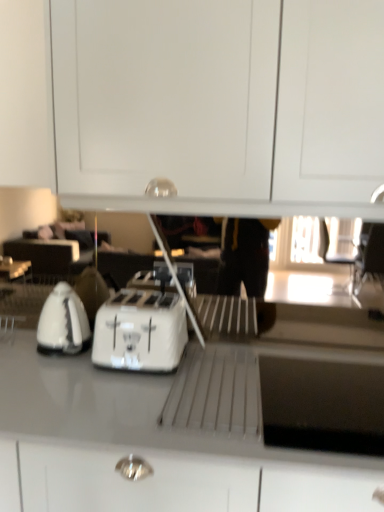
Question: From a real-world perspective, does white glossy countertop at center stand above white glossy kettle at left?

Choices:
 (A) yes
 (B) no

Answer: (B)

Question: Is white glossy countertop at center surrounding white glossy kettle at left?

Choices:
 (A) no
 (B) yes

Answer: (A)

Question: Does white glossy countertop at center come in front of white glossy kettle at left?

Choices:
 (A) no
 (B) yes

Answer: (B)

Question: Is white glossy countertop at center touching white glossy kettle at left?

Choices:
 (A) no
 (B) yes

Answer: (A)

Question: Is white glossy countertop at center smaller than white glossy kettle at left?

Choices:
 (A) yes
 (B) no

Answer: (B)

Question: Can you confirm if white glossy countertop at center is thinner than white glossy kettle at left?

Choices:
 (A) yes
 (B) no

Answer: (B)

Question: From the image's perspective, would you say white plastic toaster at center is shown under white glossy countertop at center?

Choices:
 (A) no
 (B) yes

Answer: (A)

Question: Is white plastic toaster at center shorter than white glossy countertop at center?

Choices:
 (A) yes
 (B) no

Answer: (A)

Question: From the image's perspective, is white plastic toaster at center over white glossy countertop at center?

Choices:
 (A) no
 (B) yes

Answer: (B)

Question: Is white plastic toaster at center taller than white glossy countertop at center?

Choices:
 (A) no
 (B) yes

Answer: (A)

Question: From a real-world perspective, is white plastic toaster at center physically above white glossy countertop at center?

Choices:
 (A) no
 (B) yes

Answer: (B)

Question: Does white plastic toaster at center appear on the left side of white glossy countertop at center?

Choices:
 (A) yes
 (B) no

Answer: (A)

Question: Is white glossy countertop at center oriented away from white glossy cabinet at upper center?

Choices:
 (A) no
 (B) yes

Answer: (A)